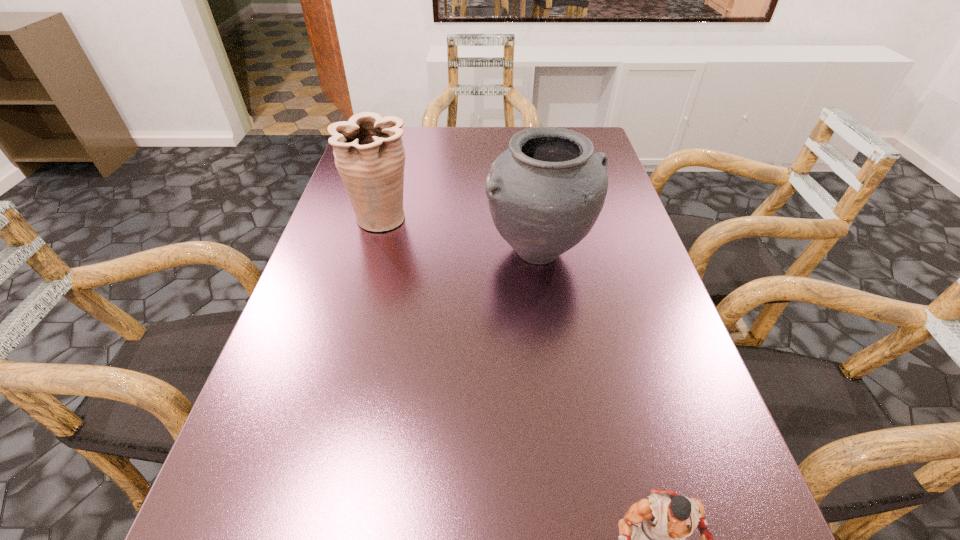
The width and height of the screenshot is (960, 540). I want to click on the right urn, so click(x=545, y=192).

The width and height of the screenshot is (960, 540). Identify the location of the left urn. (369, 155).

Locate an element on the screen. Image resolution: width=960 pixels, height=540 pixels. vacant region located on the front of the right urn is located at coordinates (553, 343).

This screenshot has width=960, height=540. Find the location of `vacant region located on the back of the leftmost object`. vacant region located on the back of the leftmost object is located at coordinates (403, 138).

Find the location of a particular element. Image resolution: width=960 pixels, height=540 pixels. object located in the left edge section of the desktop is located at coordinates (369, 155).

You are a GUI agent. You are given a task and a screenshot of the screen. Output one action in this format:
    pyautogui.click(x=<x>, y=<y>)
    Task: Click on the object that is at the right edge
    The image size is (960, 540).
    Given the screenshot: What is the action you would take?
    pyautogui.click(x=545, y=192)

Image resolution: width=960 pixels, height=540 pixels. I want to click on free spot at the far edge of the desktop, so click(418, 154).

Locate an element on the screen. The image size is (960, 540). vacant space at the left edge is located at coordinates (358, 309).

The height and width of the screenshot is (540, 960). Find the location of `free space at the right edge of the desktop`. free space at the right edge of the desktop is located at coordinates (623, 285).

Where is `vacant space at the far right corner`? The height and width of the screenshot is (540, 960). vacant space at the far right corner is located at coordinates (592, 144).